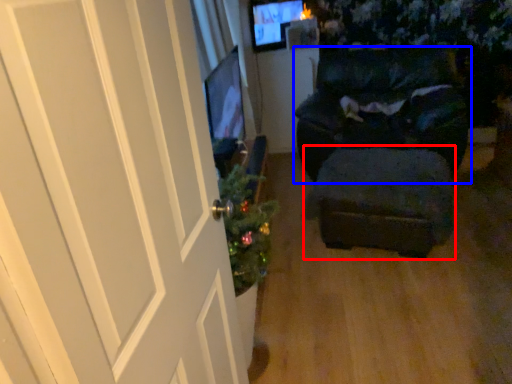
Question: Which point is closer to the camera, stool (highlighted by a red box) or furniture (highlighted by a blue box)?

Choices:
 (A) stool
 (B) furniture

Answer: (A)